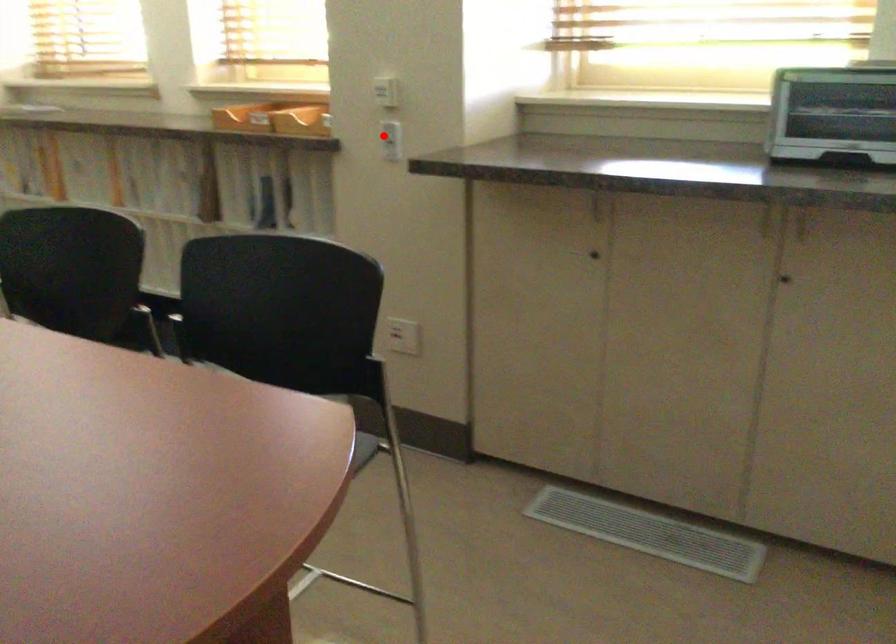
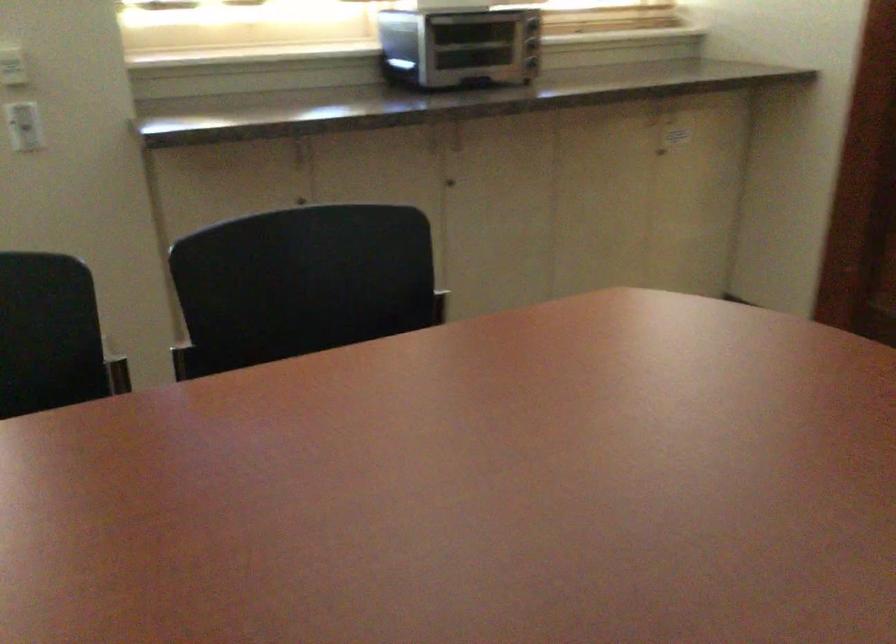
Question: A red point is marked in image1. In image2, is the corresponding 3D point closer to the camera or farther? Reply with the corresponding letter.

Choices:
 (A) The corresponding 3D point is closer.
 (B) The corresponding 3D point is farther.

Answer: (A)